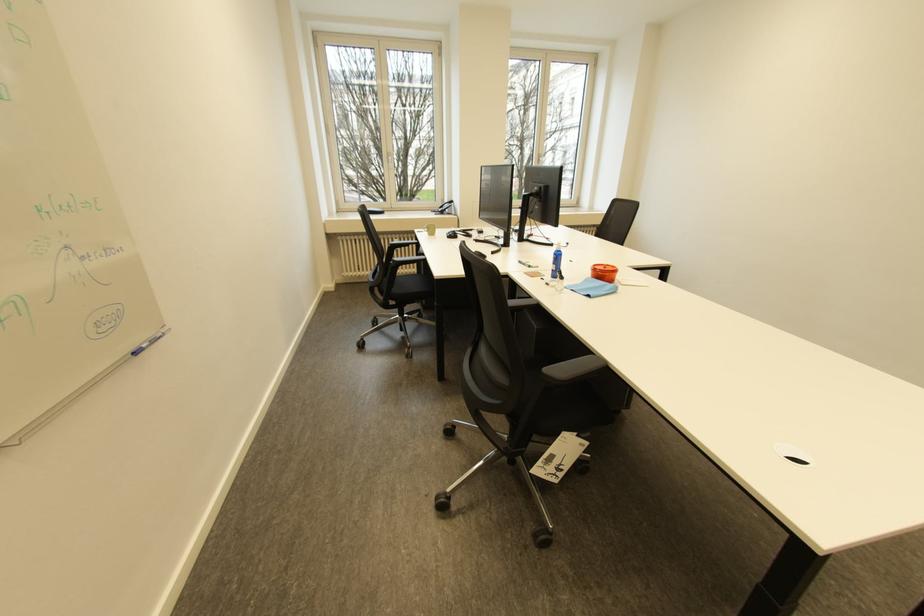
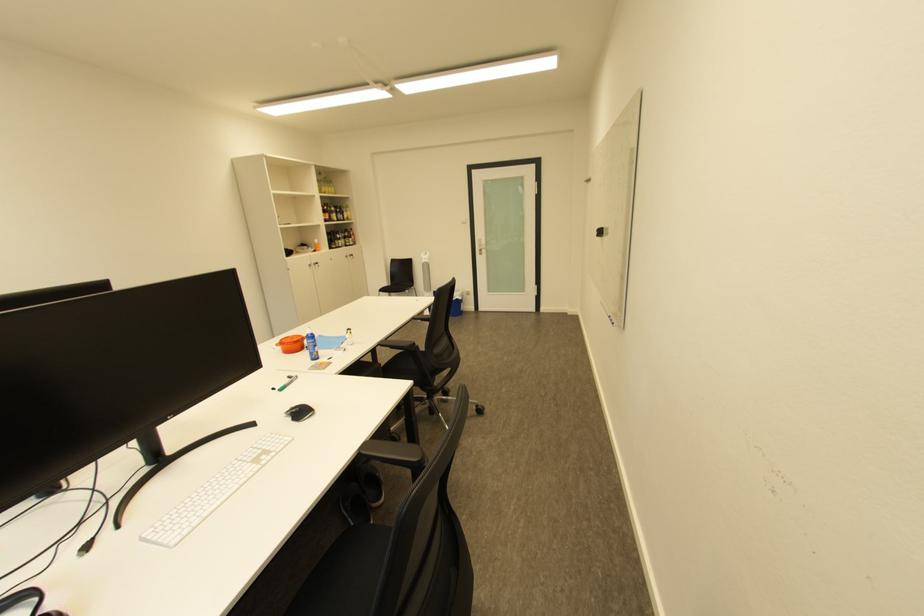
Question: I am providing you with two images of the same scene from different viewpoints. After the viewpoint changes to image2, which objects are now occluded?

Choices:
 (A) blue rocker switch
 (B) chair armrest
 (C) black computer mouse
 (D) orange plastic bowl

Answer: (B)